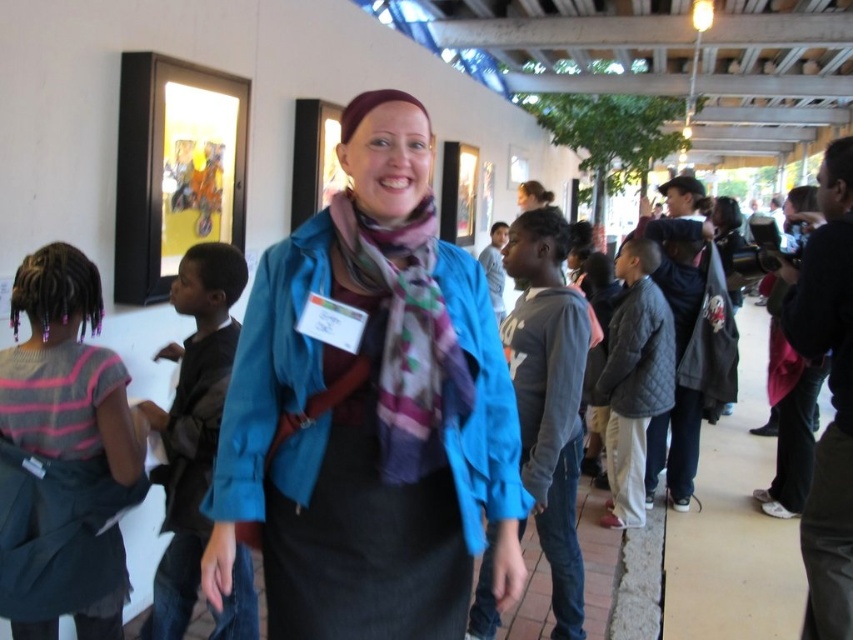
You are a photographer trying to capture a group photo of the gray fleece hoodie at center and dark blue shirt at center. Which person should you position closer to the camera to ensure both are in focus?

The gray fleece hoodie at center is much taller than the dark blue shirt at center, so you should position the dark blue shirt at center closer to the camera to ensure both are in focus.

You are a tailor measuring the distance between the gray fleece hoodie at center and the multicolored woven scarf at center for a custom fitting. The minimum required space for your measuring tape is 36 inches. Can you measure them effectively?

The distance between the gray fleece hoodie at center and the multicolored woven scarf at center is 38.45 inches, which exceeds the 36 inches minimum requirement. Therefore, the measuring tape can be used effectively between them.